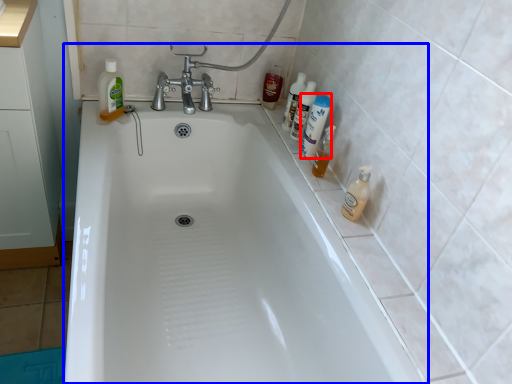
Question: Which of the following is the farthest to the observer, cleaning product (highlighted by a red box) or bathtub (highlighted by a blue box)?

Choices:
 (A) cleaning product
 (B) bathtub

Answer: (A)